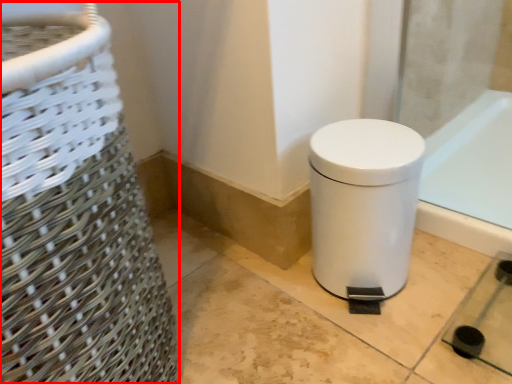
Question: From the image's perspective, where is basket container (annotated by the red box) located in relation to waste container in the image?

Choices:
 (A) above
 (B) below

Answer: (A)